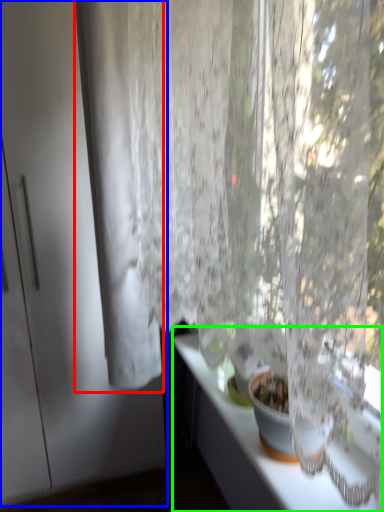
Question: Which object is the closest to the curtain (highlighted by a red box)? Choose among these: screen door (highlighted by a blue box) or counter top (highlighted by a green box).

Choices:
 (A) screen door
 (B) counter top

Answer: (A)